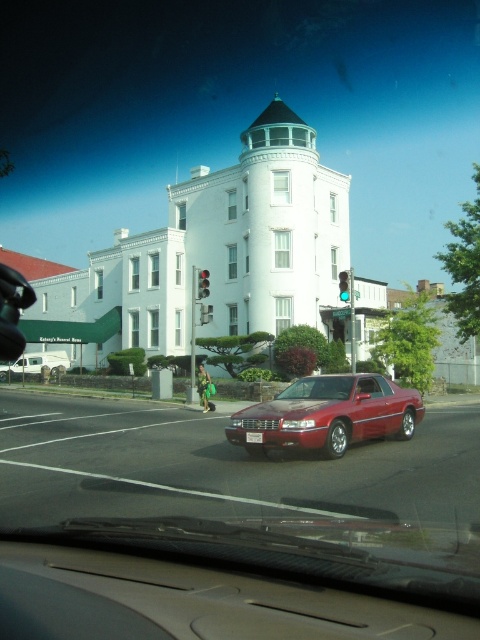
Is white matte van at left to the right of red glass traffic light at center from the viewer's perspective?

In fact, white matte van at left is to the left of red glass traffic light at center.

Does white matte van at left lie behind red glass traffic light at center?

No.

Who is more distant from viewer, (15, 372) or (202, 269)?

The point (15, 372) is behind.

Find the location of `white matte van at left`. white matte van at left is located at coordinates (x=35, y=364).

Consider the image. Which of these two, glossy red car at center or white matte van at left, stands taller?

white matte van at left

Between glossy red car at center and white matte van at left, which one is positioned lower?

white matte van at left

The width and height of the screenshot is (480, 640). Describe the element at coordinates (327, 413) in the screenshot. I see `glossy red car at center` at that location.

The width and height of the screenshot is (480, 640). I want to click on glossy red car at center, so click(327, 413).

Does glossy red car at center appear on the left side of green glass traffic light at upper center?

Indeed, glossy red car at center is positioned on the left side of green glass traffic light at upper center.

How much distance is there between glossy red car at center and green glass traffic light at upper center?

glossy red car at center and green glass traffic light at upper center are 14.15 meters apart from each other.

Locate an element on the screen. glossy red car at center is located at coordinates (327, 413).

The image size is (480, 640). Find the location of `glossy red car at center`. glossy red car at center is located at coordinates (327, 413).